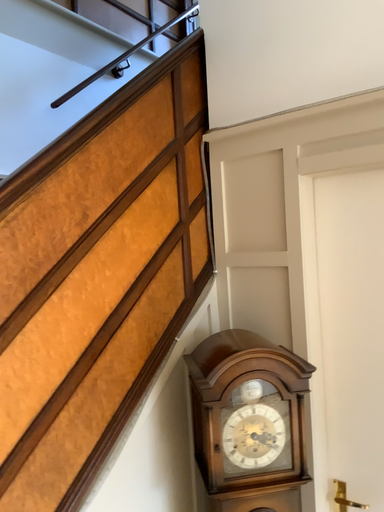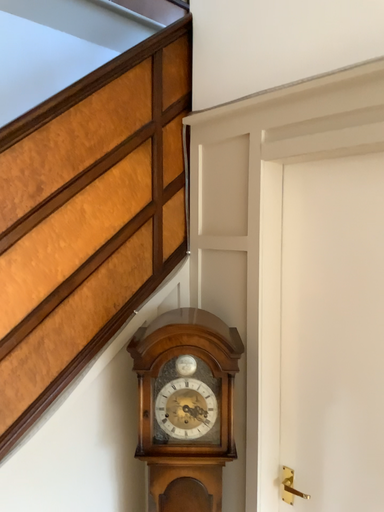
Question: Which way did the camera rotate in the video?

Choices:
 (A) rotated right
 (B) rotated left

Answer: (B)